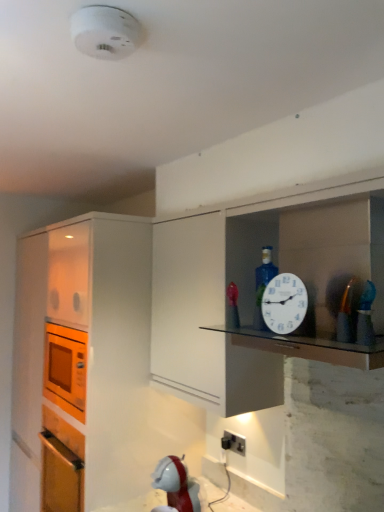
Question: Based on their positions, is metallic gold toy at right located to the left or right of black plastic electric outlet at lower center?

Choices:
 (A) left
 (B) right

Answer: (B)

Question: From a real-world perspective, is metallic gold toy at right positioned above or below black plastic electric outlet at lower center?

Choices:
 (A) below
 (B) above

Answer: (B)

Question: Which of these objects is positioned farthest from the transparent glass shelf at upper center?

Choices:
 (A) metallic gold toy at right
 (B) white plastic smoke detector at upper center
 (C) white plastic clock at upper right
 (D) orange matte microwave at left
 (E) black plastic electric outlet at lower center

Answer: (D)

Question: Which object is positioned farthest from the black plastic electric outlet at lower center?

Choices:
 (A) transparent glass shelf at upper center
 (B) orange matte microwave at left
 (C) white plastic clock at upper right
 (D) white plastic smoke detector at upper center
 (E) metallic gold toy at right

Answer: (D)